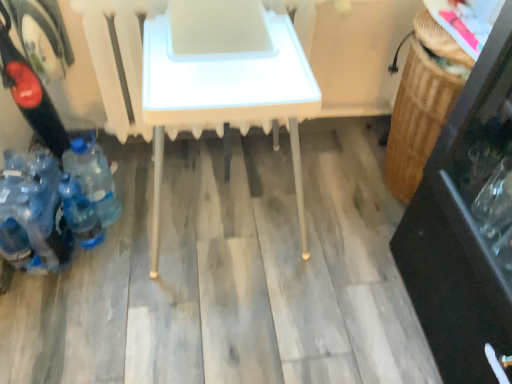
This screenshot has height=384, width=512. In order to click on vacant area that lies between white plastic table at center and blue plastic bottle at lower left, the 2th bottle positioned from the right in this screenshot , I will do `click(128, 237)`.